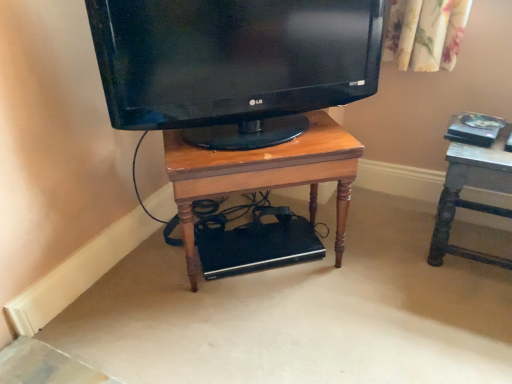
Question: From a real-world perspective, relative to wooden desk at center, is matte black tv at center vertically above or below?

Choices:
 (A) above
 (B) below

Answer: (A)

Question: Choose the correct answer: Is matte black tv at center inside wooden desk at center or outside it?

Choices:
 (A) inside
 (B) outside

Answer: (B)

Question: Which object is positioned closest to the wooden desk at center?

Choices:
 (A) wooden table at right
 (B) matte black tv at center

Answer: (B)

Question: Estimate the real-world distances between objects in this image. Which object is farther from the wooden table at right?

Choices:
 (A) wooden desk at center
 (B) matte black tv at center

Answer: (B)